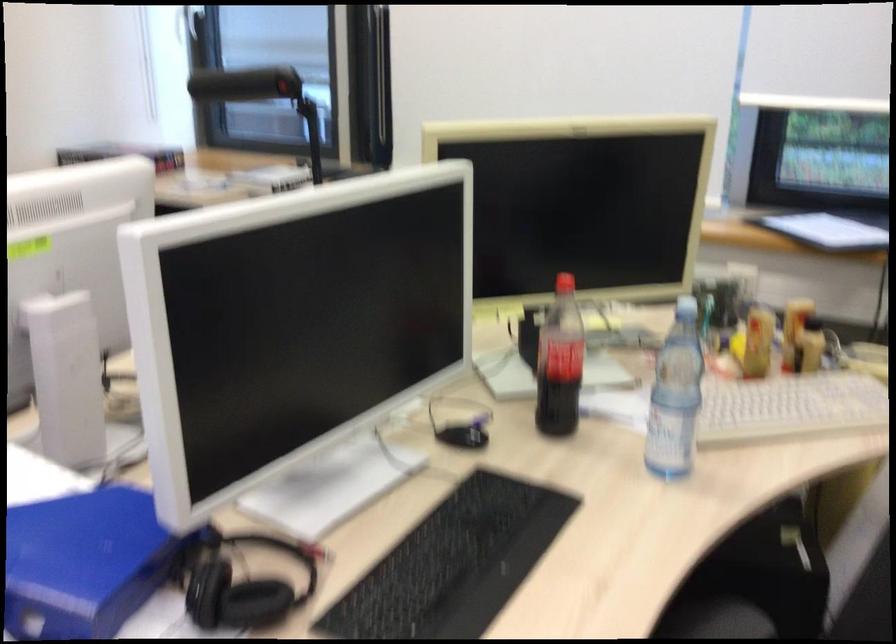
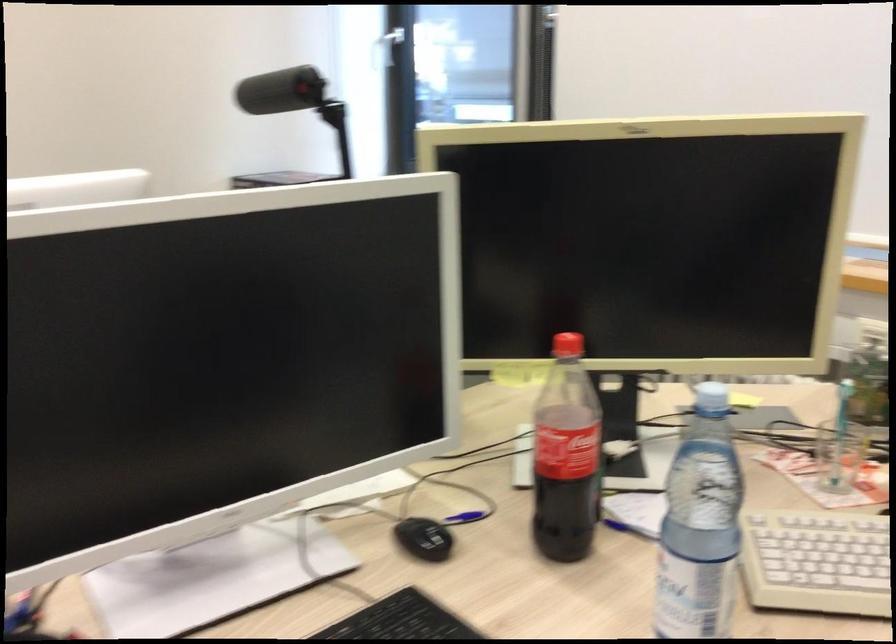
Find the pixel in the second image that matches point 480,489 in the first image.

(401, 620)